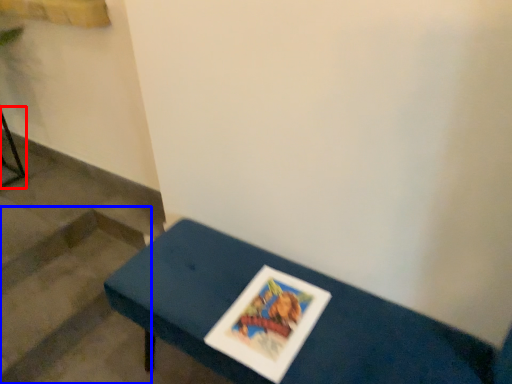
Question: Which object appears farthest to the camera in this image, furniture (highlighted by a red box) or stairwell (highlighted by a blue box)?

Choices:
 (A) furniture
 (B) stairwell

Answer: (A)